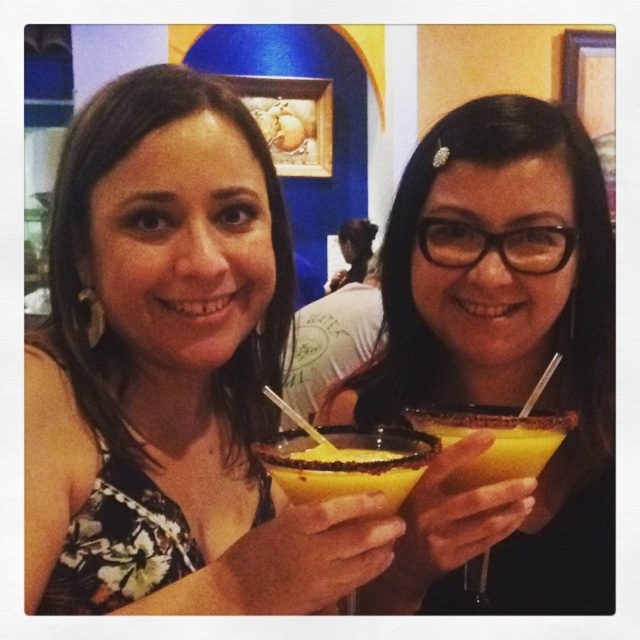
Question: Does yellowcrushed icecocktail at center lie behind yellowcrushed icecocktail at right?

Choices:
 (A) no
 (B) yes

Answer: (A)

Question: Can you confirm if matte black cocktail glass at center is thinner than yellow liquid at center?

Choices:
 (A) no
 (B) yes

Answer: (A)

Question: Which point appears closest to the camera in this image?

Choices:
 (A) (48, 608)
 (B) (564, 172)

Answer: (A)

Question: Which point is farther to the camera?

Choices:
 (A) (x=145, y=556)
 (B) (x=305, y=461)
 (C) (x=435, y=380)

Answer: (C)

Question: Where is matte yellow cocktail glass at right located in relation to yellowcrushed icecocktail at right in the image?

Choices:
 (A) below
 (B) above

Answer: (B)

Question: Which object is farther from the camera taking this photo?

Choices:
 (A) matte black cocktail glass at center
 (B) yellow liquid at center
 (C) yellowcrushed icecocktail at right

Answer: (C)